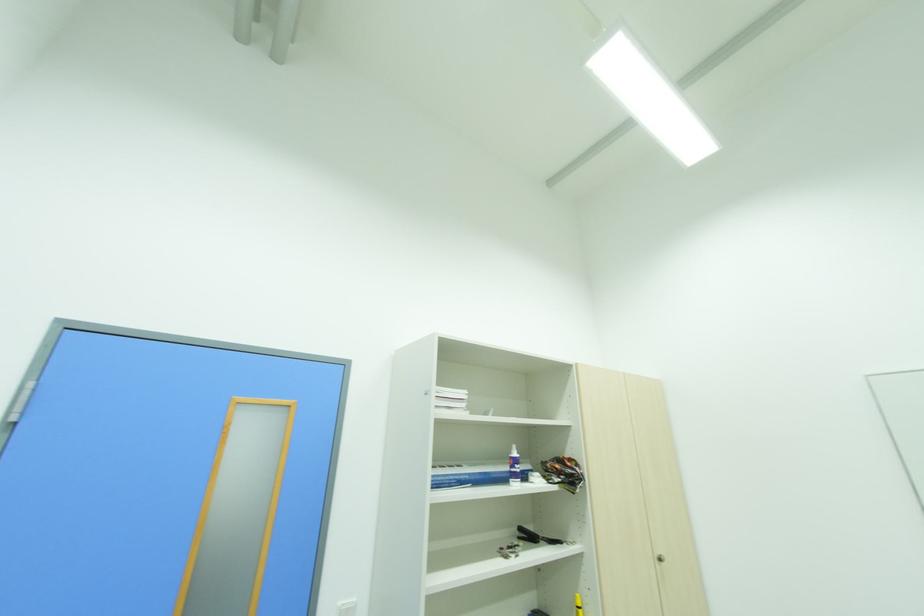
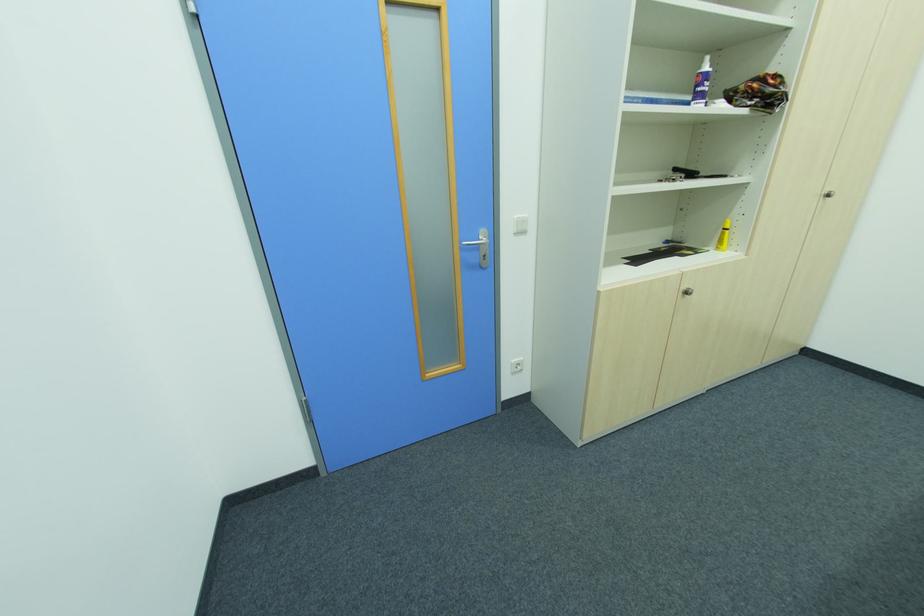
In the second image, find the point that corresponds to point (660, 562) in the first image.

(822, 198)